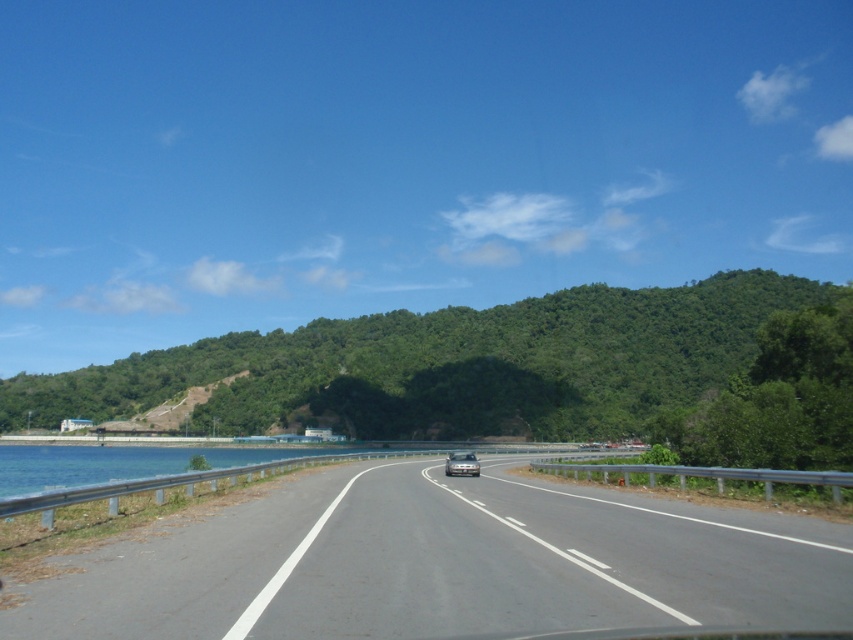
Question: Among these objects, which one is nearest to the camera?

Choices:
 (A) silver metallic car at center
 (B) gray asphalt highway at center

Answer: (B)

Question: Can you confirm if gray asphalt highway at center is positioned to the right of silver metallic car at center?

Choices:
 (A) yes
 (B) no

Answer: (B)

Question: Which point is farther from the camera taking this photo?

Choices:
 (A) (444, 470)
 (B) (375, 506)

Answer: (A)

Question: Is gray asphalt highway at center to the left of silver metallic car at center from the viewer's perspective?

Choices:
 (A) yes
 (B) no

Answer: (A)

Question: Is gray asphalt highway at center to the left of silver metallic car at center from the viewer's perspective?

Choices:
 (A) yes
 (B) no

Answer: (A)